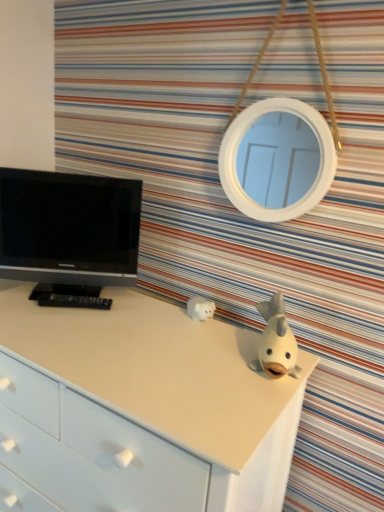
This screenshot has width=384, height=512. I want to click on free point above white matte chest of drawers at center (from a real-world perspective), so click(135, 335).